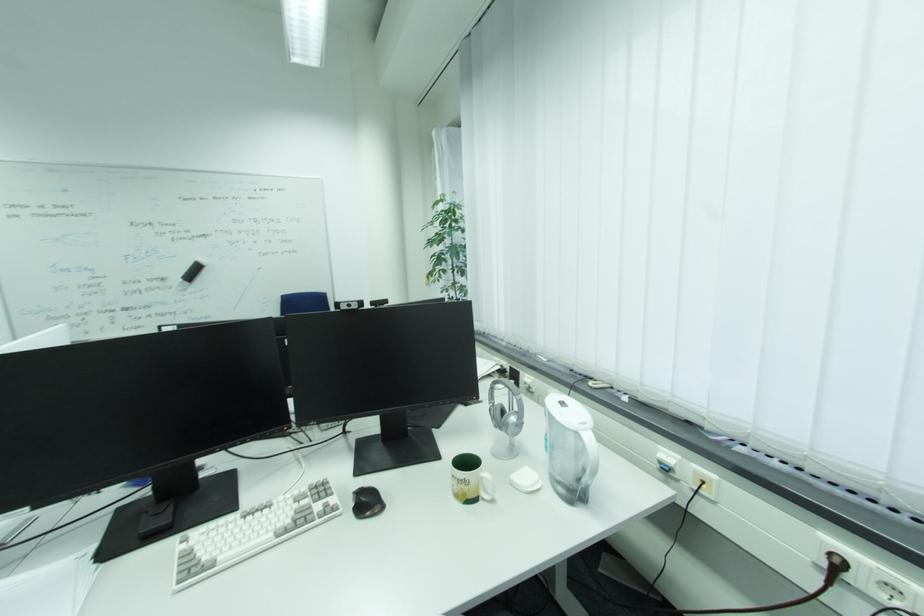
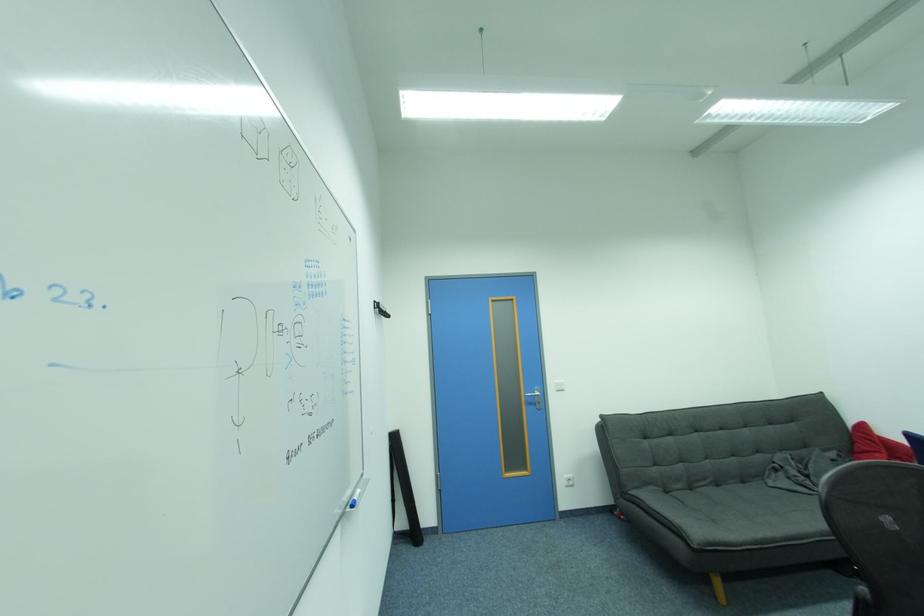
Question: The camera is either moving clockwise (left) or counter-clockwise (right) around the object. The first image is from the beginning of the video and the second image is from the end. Is the camera moving left or right when shooting the video?

Choices:
 (A) Left
 (B) Right

Answer: (B)